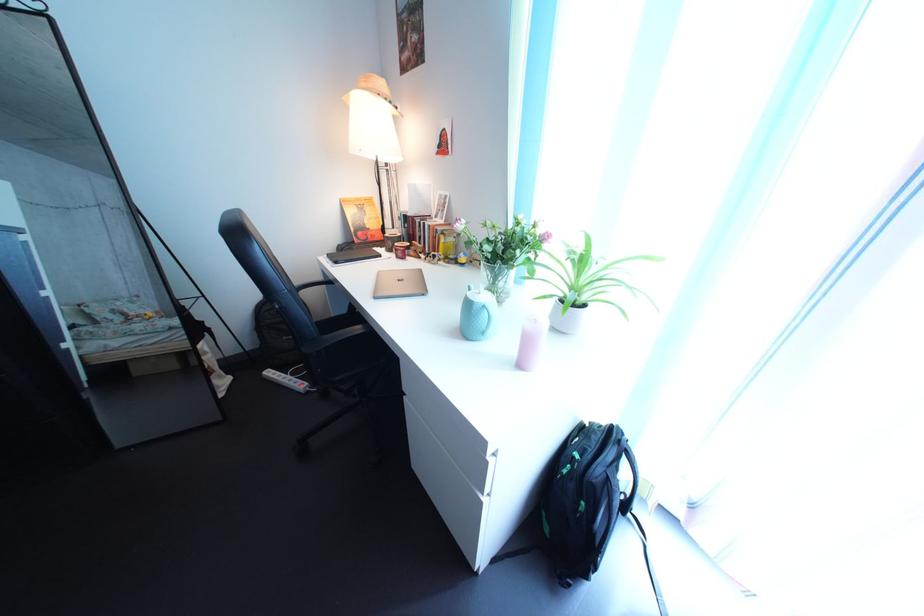
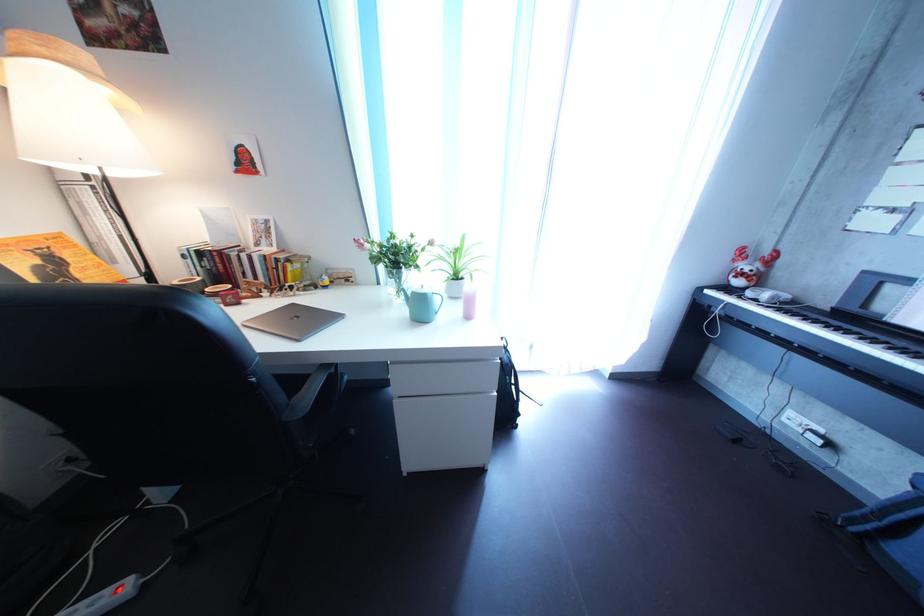
Question: Based on the continuous images, in which direction is the camera rotating? Reply with the corresponding letter.

Choices:
 (A) Left
 (B) Right
 (C) Up
 (D) Down

Answer: (B)